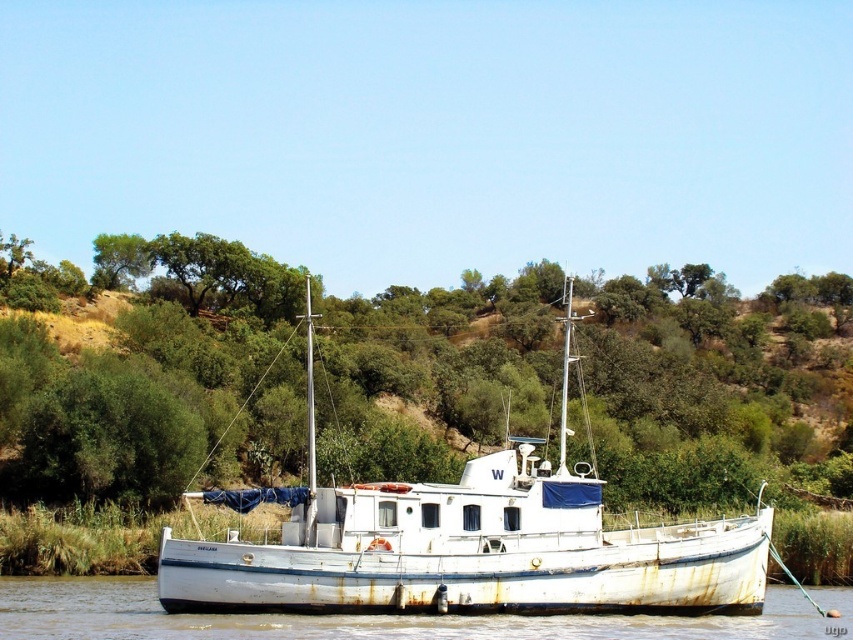
You are standing at the point marked by the coordinates point (x=173, y=372) in the image. What object are you directly facing?

You are directly facing the green leafy tree at center, as the coordinates point (x=173, y=372) corresponds to its location.

You are a photographer planning to take a photo of the white matte boat at center and the green leafy tree at center from the riverside. Which object should you focus on first if you want to capture both in the frame without moving the camera?

The green leafy tree at center has a larger size compared to the white matte boat at center, so you should focus on the green leafy tree at center first to ensure it fits properly in the frame before adjusting for the smaller boat.

You are a photographer planning to capture the white matte boat at center and the green leafy tree at center in a single wide shot. Considering their widths, which object will occupy more space horizontally in the photo?

The green leafy tree at center has a greater width than the white matte boat at center, so it will occupy more horizontal space in the photo.